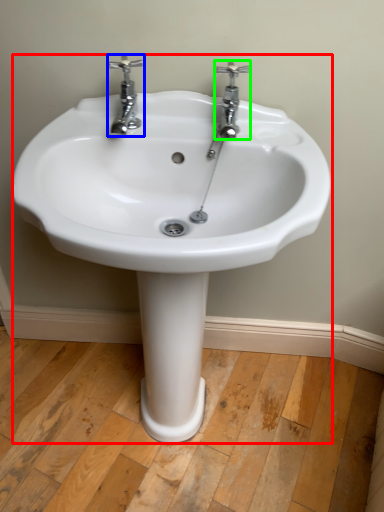
Question: Which object is the closest to the sink (highlighted by a red box)? Choose among these: tap (highlighted by a blue box) or tap (highlighted by a green box).

Choices:
 (A) tap
 (B) tap

Answer: (A)